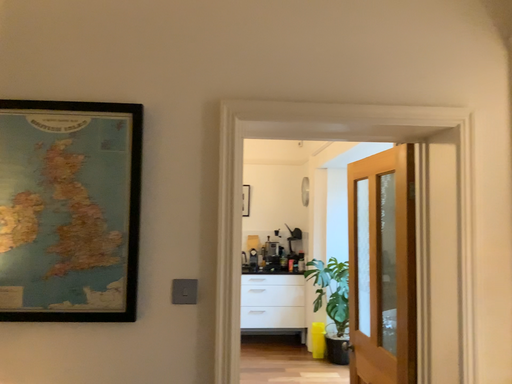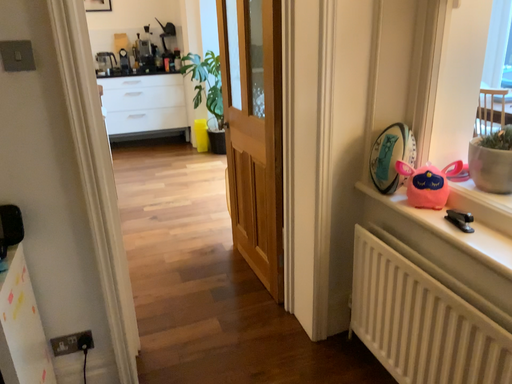
Question: Which way did the camera rotate in the video?

Choices:
 (A) rotated right
 (B) rotated left

Answer: (A)